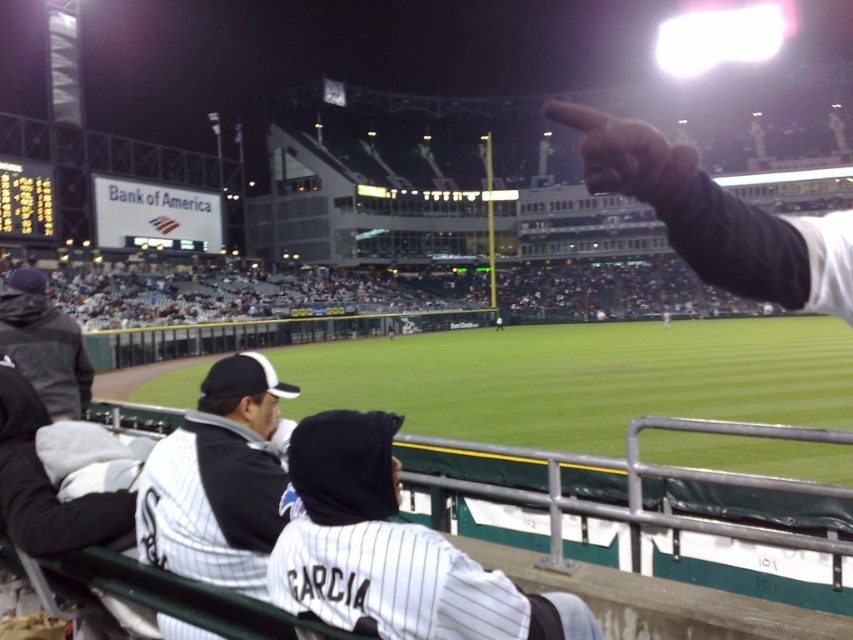
Question: Which object is farther from the camera taking this photo?

Choices:
 (A) white pinstriped jersey at center
 (B) dark gray hoodie at left
 (C) white pinstriped jersey at lower left
 (D) matte black finger at upper right

Answer: (B)

Question: Which is nearer to the matte black finger at upper right?

Choices:
 (A) dark gray hoodie at left
 (B) white pinstriped jersey at center
 (C) white pinstriped jersey at lower left

Answer: (B)

Question: Which of the following is the closest to the observer?

Choices:
 (A) white pinstriped jersey at center
 (B) matte black finger at upper right
 (C) white pinstriped jersey at lower left
 (D) dark gray hoodie at left

Answer: (B)

Question: Does white pinstriped jersey at center come behind white pinstriped jersey at lower left?

Choices:
 (A) yes
 (B) no

Answer: (B)

Question: Can you confirm if white pinstriped jersey at lower left is positioned to the left of dark gray hoodie at left?

Choices:
 (A) no
 (B) yes

Answer: (A)

Question: Does white pinstriped jersey at lower left appear under matte black finger at upper right?

Choices:
 (A) no
 (B) yes

Answer: (B)